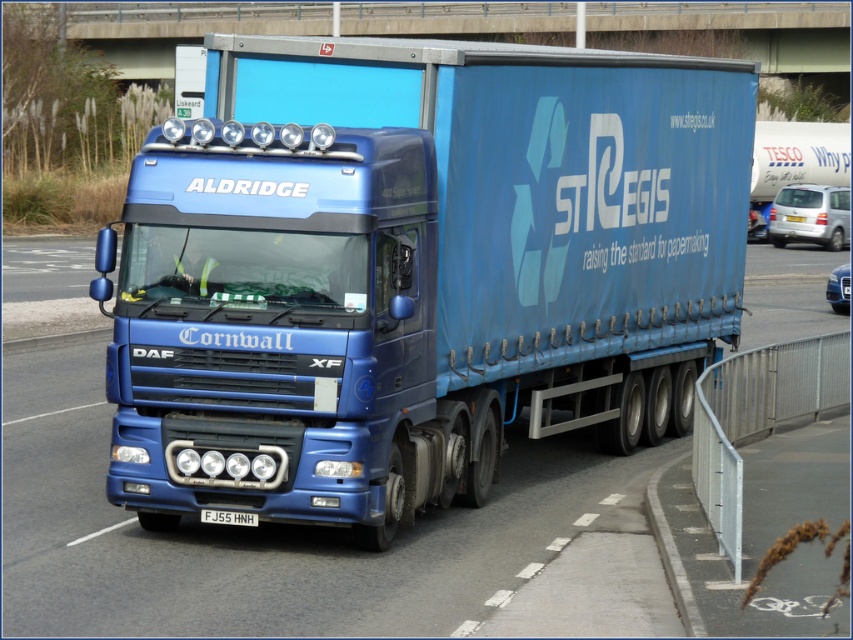
Question: Which object is farther from the camera taking this photo?

Choices:
 (A) matte blue trailer truck at center
 (B) blue metallic truck at center
 (C) white plastic license plate at center

Answer: (C)

Question: Does matte blue trailer truck at center have a lesser width compared to white plastic license plate at center?

Choices:
 (A) yes
 (B) no

Answer: (B)

Question: Which object is closer to the camera taking this photo?

Choices:
 (A) matte blue trailer truck at center
 (B) blue metallic truck at center
 (C) white plastic license plate at center

Answer: (B)

Question: Is blue metallic truck at center below white plastic license plate at center?

Choices:
 (A) yes
 (B) no

Answer: (B)

Question: Can you confirm if matte blue trailer truck at center is positioned to the left of white plastic license plate at center?

Choices:
 (A) no
 (B) yes

Answer: (A)

Question: Which is farther from the matte blue trailer truck at center?

Choices:
 (A) white plastic license plate at center
 (B) blue metallic truck at center

Answer: (A)